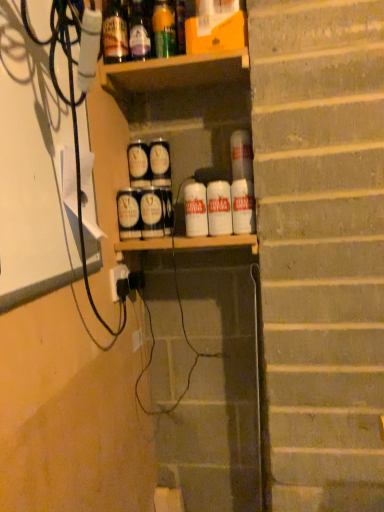
Find the location of a particular element. This screenshot has height=512, width=384. white matte can at right, the 5th beverage positioned from the left is located at coordinates (243, 207).

What is the approximate width of green glass bottle at upper center, which ranks as the 1th bottle in right-to-left order?

green glass bottle at upper center, which ranks as the 1th bottle in right-to-left order, is 2.05 inches wide.

The width and height of the screenshot is (384, 512). I want to click on white matte can at center, the 2th beverage when ordered from left to right, so (x=195, y=210).

This screenshot has width=384, height=512. What do you see at coordinates (195, 210) in the screenshot? I see `white matte can at center, the 2th beverage when ordered from left to right` at bounding box center [195, 210].

What do you see at coordinates (219, 208) in the screenshot? This screenshot has height=512, width=384. I see `white matte can at center, positioned as the 3th beverage in left-to-right order` at bounding box center [219, 208].

Describe the element at coordinates (114, 32) in the screenshot. I see `translucent glass bottle at upper center, which is the 3th bottle from right to left` at that location.

The image size is (384, 512). I want to click on translucent glass bottle at upper center, which is the 3th bottle from right to left, so click(x=114, y=32).

In order to click on white matte can at center, the 4th beverage when ordered from left to right in this screenshot , I will do `click(241, 155)`.

This screenshot has height=512, width=384. What do you see at coordinates (138, 163) in the screenshot?
I see `matte black cans at center, positioned as the third spray in front-to-back order` at bounding box center [138, 163].

I want to click on white matte can at right, which is counted as the first beverage, starting from the right, so click(x=243, y=207).

Could you measure the distance between matte silver spray can at center, the 3th spray from the back, and white matte can at center, the fourth beverage in the right-to-left sequence?

matte silver spray can at center, the 3th spray from the back, and white matte can at center, the fourth beverage in the right-to-left sequence, are 4.26 inches apart from each other.

Can you confirm if matte silver spray can at center, arranged as the 1th spray when viewed from the front, is wider than white matte can at center, the fourth beverage in the right-to-left sequence?

Yes.

Would you consider matte silver spray can at center, arranged as the 1th spray when viewed from the front, to be distant from white matte can at center, the fourth beverage in the right-to-left sequence?

No, matte silver spray can at center, arranged as the 1th spray when viewed from the front, is in close proximity to white matte can at center, the fourth beverage in the right-to-left sequence.

From their relative heights in the image, would you say matte silver spray can at center, arranged as the 1th spray when viewed from the front, is taller or shorter than white matte can at center, the fourth beverage in the right-to-left sequence?

Considering their sizes, matte silver spray can at center, arranged as the 1th spray when viewed from the front, has less height than white matte can at center, the fourth beverage in the right-to-left sequence.

In terms of width, does matte silver spray can at center, the 3th spray from the back, look wider or thinner when compared to white matte can at center, positioned as the 3th beverage in left-to-right order?

Clearly, matte silver spray can at center, the 3th spray from the back, has more width compared to white matte can at center, positioned as the 3th beverage in left-to-right order.

Based on the photo, would you say white matte can at center, the 3th beverage from the right, is part of matte silver spray can at center, the 3th spray from the back,'s contents?

No, matte silver spray can at center, the 3th spray from the back, does not contain white matte can at center, the 3th beverage from the right.

Is matte silver spray can at center, arranged as the 1th spray when viewed from the front, oriented towards white matte can at center, positioned as the 3th beverage in left-to-right order?

No, matte silver spray can at center, arranged as the 1th spray when viewed from the front, is not facing towards white matte can at center, positioned as the 3th beverage in left-to-right order.

Does point (142, 193) lie in front of point (218, 212)?

No.

Is matte silver spray can at center, the 3th spray from the back, looking in the opposite direction of matte black can at center, which appears as the fifth beverage when viewed from the right?

No, matte silver spray can at center, the 3th spray from the back, is not facing away from matte black can at center, which appears as the fifth beverage when viewed from the right.

Is point (141, 207) closer or farther from the camera than point (164, 184)?

Point (141, 207).

Can matte black can at center, which appears as the fifth beverage when viewed from the right, be found inside matte silver spray can at center, arranged as the 1th spray when viewed from the front?

No.

Locate an element on the screen. the 2nd beverage located above the matte silver spray can at center, the 3th spray from the back (from a real-world perspective) is located at coordinates (160, 163).

Which object is closer to the camera, black plastic cable at left or translucent glass bottle at upper center, the 2th bottle viewed from the left?

black plastic cable at left.

Does black plastic cable at left turn towards translucent glass bottle at upper center, the 2th bottle viewed from the left?

No, black plastic cable at left does not turn towards translucent glass bottle at upper center, the 2th bottle viewed from the left.

Which bottle is the 1st one when counting from the back of the black plastic cable at left? Please provide its 2D coordinates.

[(139, 31)]

From a real-world perspective, which object rests below the other?

black plastic cable at left is physically lower.

Is white matte can at center, the 3th beverage from the right, at the back of matte black cans at center, the second spray from the back?

matte black cans at center, the second spray from the back, does not have its back to white matte can at center, the 3th beverage from the right.

From the image's perspective, who appears lower, matte black cans at center, which is counted as the 2th spray, starting from the front, or white matte can at center, positioned as the 3th beverage in left-to-right order?

matte black cans at center, which is counted as the 2th spray, starting from the front, is shown below in the image.

How much distance is there between matte black cans at center, the second spray from the back, and white matte can at center, the 3th beverage from the right?

matte black cans at center, the second spray from the back, and white matte can at center, the 3th beverage from the right, are 9.00 inches apart.

From a real-world perspective, does matte black cans at center, which is counted as the 2th spray, starting from the front, sit lower than white matte can at center, positioned as the 3th beverage in left-to-right order?

No, from a real-world perspective, matte black cans at center, which is counted as the 2th spray, starting from the front, is not under white matte can at center, positioned as the 3th beverage in left-to-right order.

Looking at their sizes, would you say translucent glass bottle at upper center, which appears as the 1th bottle when viewed from the left, is wider or thinner than green glass bottle at upper center, the third bottle positioned from the left?

Considering their sizes, translucent glass bottle at upper center, which appears as the 1th bottle when viewed from the left, looks broader than green glass bottle at upper center, the third bottle positioned from the left.

From a real-world perspective, which bottle is the 2nd one underneath the translucent glass bottle at upper center, which is the 3th bottle from right to left? Please provide its 2D coordinates.

[(164, 29)]

Is translucent glass bottle at upper center, which is the 3th bottle from right to left, bigger or smaller than green glass bottle at upper center, the third bottle positioned from the left?

Clearly, translucent glass bottle at upper center, which is the 3th bottle from right to left, is larger in size than green glass bottle at upper center, the third bottle positioned from the left.

Is point (113, 55) farther from viewer compared to point (159, 28)?

No, it is not.

Is translucent glass bottle at upper center, which is the 3th bottle from right to left, facing away from black plastic cable at left?

translucent glass bottle at upper center, which is the 3th bottle from right to left, does not have its back to black plastic cable at left.

Find the location of a particular element. This screenshot has height=512, width=384. the 2nd bottle behind the black plastic cable at left is located at coordinates (114, 32).

Is point (109, 51) closer or farther from the camera than point (60, 42)?

Point (109, 51) is farther from the camera than point (60, 42).

Is translucent glass bottle at upper center, which is the 3th bottle from right to left, to the right of black plastic cable at left from the viewer's perspective?

Yes, translucent glass bottle at upper center, which is the 3th bottle from right to left, is to the right of black plastic cable at left.

This screenshot has height=512, width=384. I want to click on the 2nd beverage to the right when counting from the matte silver spray can at center, the 3th spray from the back, so click(195, 210).

You are a GUI agent. You are given a task and a screenshot of the screen. Output one action in this format:
    pyautogui.click(x=<x>, y=<y>)
    Task: Click on the beverage that is the 2nd object directly below the matte silver spray can at center, the 3th spray from the back (from a real-world perspective)
    Image resolution: width=384 pixels, height=512 pixels.
    Given the screenshot: What is the action you would take?
    pyautogui.click(x=219, y=208)

Considering their positions, is translucent glass bottle at upper center, arranged as the second bottle when viewed from the right, positioned closer to translucent glass bottle at upper center, which is the 3th bottle from right to left, than white matte can at center, the 3th beverage from the right?

translucent glass bottle at upper center, arranged as the second bottle when viewed from the right, lies closer to translucent glass bottle at upper center, which is the 3th bottle from right to left, than the other object.

Looking at the image, which one is located closer to matte silver spray can at center, arranged as the 1th spray when viewed from the front, translucent glass bottle at upper center, which appears as the 1th bottle when viewed from the left, or translucent glass bottle at upper center, the 2th bottle viewed from the left?

translucent glass bottle at upper center, the 2th bottle viewed from the left, is closer to matte silver spray can at center, arranged as the 1th spray when viewed from the front.

Estimate the real-world distances between objects in this image. Which object is closer to white plastic electric outlet at lower center, white matte can at center, the second beverage positioned from the right, or white matte can at center, positioned as the 3th beverage in left-to-right order?

The object closer to white plastic electric outlet at lower center is white matte can at center, positioned as the 3th beverage in left-to-right order.

Considering their positions, is black plastic cable at left positioned closer to white matte can at center, the 4th beverage when ordered from left to right, than matte black cans at center, the second spray from the back?

Based on the image, matte black cans at center, the second spray from the back, appears to be nearer to white matte can at center, the 4th beverage when ordered from left to right.

When comparing their distances from black plastic cable at left, does matte black cans at center, which is counted as the 2th spray, starting from the front, or matte black cans at center, which ranks as the 1th spray in back-to-front order, seem further?

matte black cans at center, which ranks as the 1th spray in back-to-front order.

Based on their spatial positions, is matte black cans at center, the second spray from the back, or white plastic electric outlet at lower center closer to black plastic cable at left?

matte black cans at center, the second spray from the back, lies closer to black plastic cable at left than the other object.

Based on their spatial positions, is white matte can at right, which is counted as the first beverage, starting from the right, or white plastic electric outlet at lower center further from translucent glass bottle at upper center, which appears as the 1th bottle when viewed from the left?

Based on the image, white plastic electric outlet at lower center appears to be further to translucent glass bottle at upper center, which appears as the 1th bottle when viewed from the left.

When comparing their distances from black plastic cable at left, does translucent glass bottle at upper center, which appears as the 1th bottle when viewed from the left, or white matte can at right, which is counted as the first beverage, starting from the right, seem closer?

translucent glass bottle at upper center, which appears as the 1th bottle when viewed from the left.

I want to click on spray between matte black cans at center, positioned as the third spray in front-to-back order, and white matte can at right, which is counted as the first beverage, starting from the right, so click(151, 213).

I want to click on spray between green glass bottle at upper center, the third bottle positioned from the left, and white matte can at center, the 3th beverage from the right, in the vertical direction, so click(138, 163).

This screenshot has height=512, width=384. In order to click on spray between matte silver spray can at center, arranged as the 1th spray when viewed from the front, and white plastic electric outlet at lower center vertically in this screenshot , I will do point(128,214).

Where is `spray that lies between translucent glass bottle at upper center, the 2th bottle viewed from the left, and matte silver spray can at center, arranged as the 1th spray when viewed from the front, from top to bottom`? spray that lies between translucent glass bottle at upper center, the 2th bottle viewed from the left, and matte silver spray can at center, arranged as the 1th spray when viewed from the front, from top to bottom is located at coordinates [138, 163].